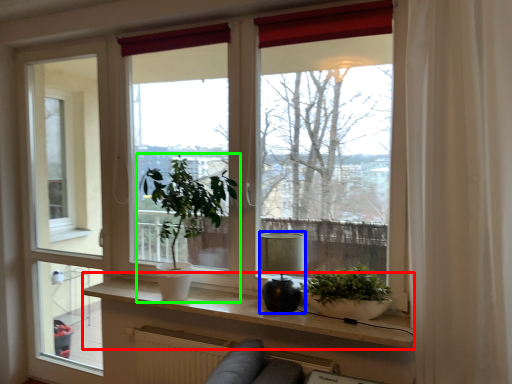
Question: Estimate the real-world distances between objects in this image. Which object is farther from window sill (highlighted by a red box), lamp (highlighted by a blue box) or houseplant (highlighted by a green box)?

Choices:
 (A) lamp
 (B) houseplant

Answer: (B)